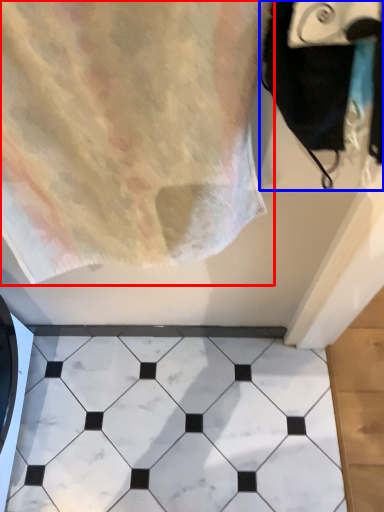
Question: Which object appears closest to the camera in this image, towel (highlighted by a red box) or bath towel (highlighted by a blue box)?

Choices:
 (A) towel
 (B) bath towel

Answer: (B)